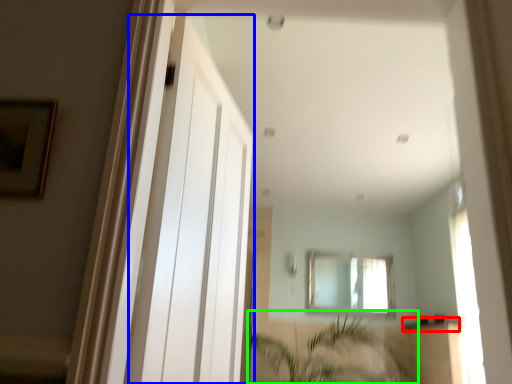
Question: Based on their relative distances, which object is nearer to window sill (highlighted by a red box)? Choose from screen door (highlighted by a blue box) and vegetation (highlighted by a green box).

Choices:
 (A) screen door
 (B) vegetation

Answer: (B)